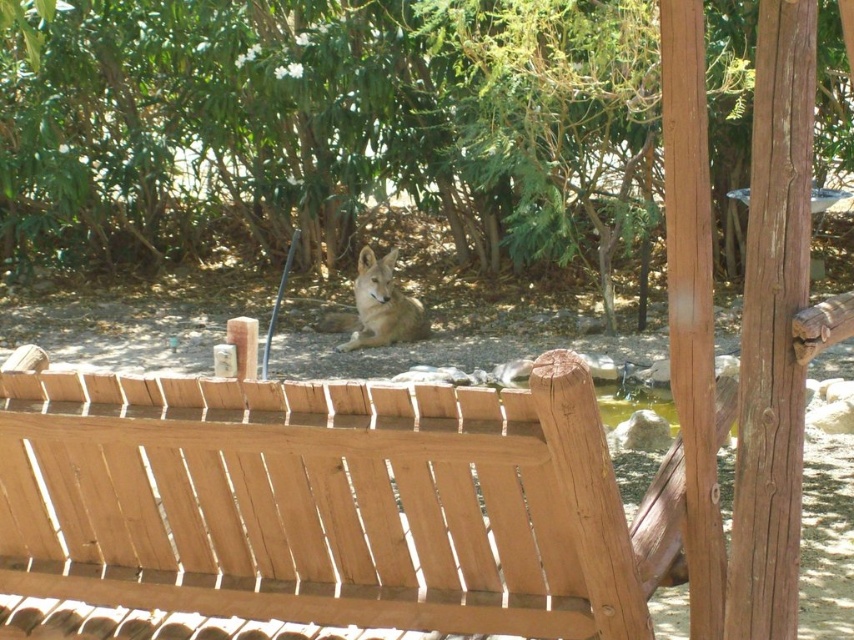
Between green leafy tree at center and light brown wood bench at lower center, which one appears on the right side from the viewer's perspective?

light brown wood bench at lower center is more to the right.

Identify the location of green leafy tree at center. (326, 125).

Is point (446, 65) behind point (651, 529)?

Yes, it is behind point (651, 529).

Where is `green leafy tree at center`? The image size is (854, 640). green leafy tree at center is located at coordinates (326, 125).

Does light brown wood bench at lower center have a greater width compared to fur-coated coyote at center?

Yes.

Between light brown wood bench at lower center and fur-coated coyote at center, which one appears on the left side from the viewer's perspective?

fur-coated coyote at center

Who is more distant from viewer, [332,412] or [402,326]?

Positioned behind is point [402,326].

I want to click on light brown wood bench at lower center, so click(x=325, y=506).

Is green leafy tree at center above fur-coated coyote at center?

Yes.

Who is more distant from viewer, (566,0) or (370,284)?

Point (370,284)

I want to click on green leafy tree at center, so click(x=326, y=125).